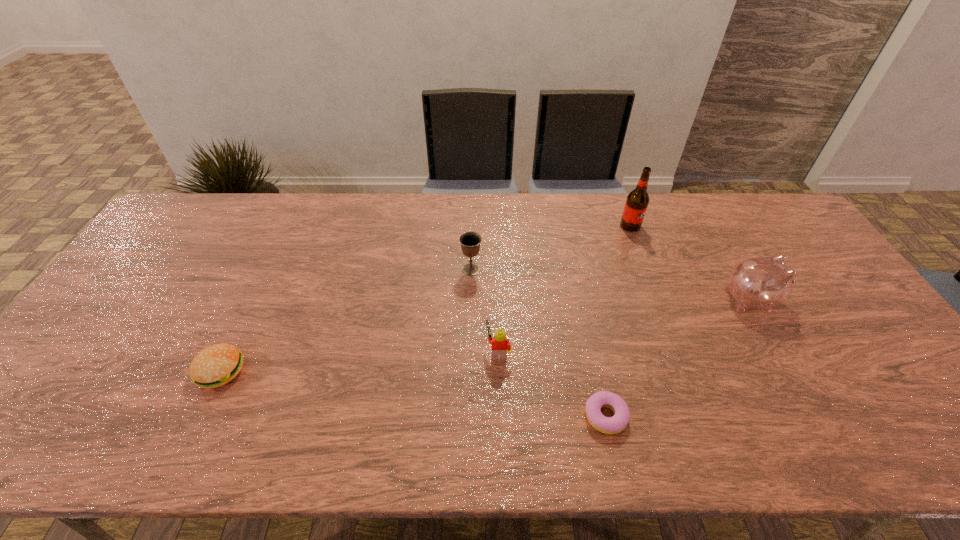
In order to click on free point between the nearest object and the farthest object in this screenshot , I will do `click(618, 321)`.

Image resolution: width=960 pixels, height=540 pixels. Identify the location of empty location between the shortest object and the Lego. (552, 383).

I want to click on unoccupied position between the chalice and the doughnut, so click(539, 343).

Find the location of `free point between the third tallest object and the piggy bank`. free point between the third tallest object and the piggy bank is located at coordinates (611, 285).

Find the location of a particular element. vacant area that lies between the fifth shortest object and the nearest object is located at coordinates (678, 358).

Where is `free area in between the doughnut and the root beer`? This screenshot has width=960, height=540. free area in between the doughnut and the root beer is located at coordinates (618, 321).

The width and height of the screenshot is (960, 540). Find the location of `free space between the second farthest object and the patty`. free space between the second farthest object and the patty is located at coordinates pyautogui.click(x=346, y=320).

Identify the location of empty location between the third object from right to left and the third tallest object. The width and height of the screenshot is (960, 540). (539, 343).

The image size is (960, 540). Identify the location of empty space between the farthest object and the fourth object from right to left. (564, 288).

Where is `object that is the fourth nearest to the patty`? The height and width of the screenshot is (540, 960). object that is the fourth nearest to the patty is located at coordinates (637, 201).